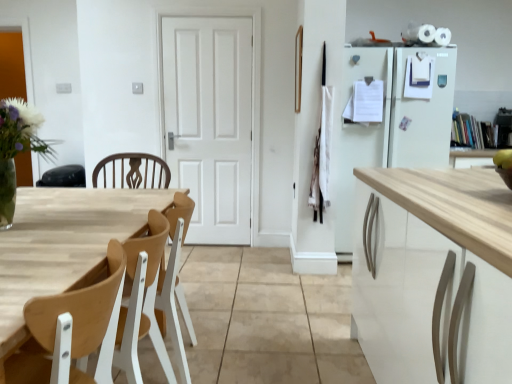
At what (x,y) coordinates should I click in order to perform the action: click on unoccupied space behind clear glass vase at left. Please return your answer as a coordinate pair (x, y). The width and height of the screenshot is (512, 384). Looking at the image, I should click on tap(53, 205).